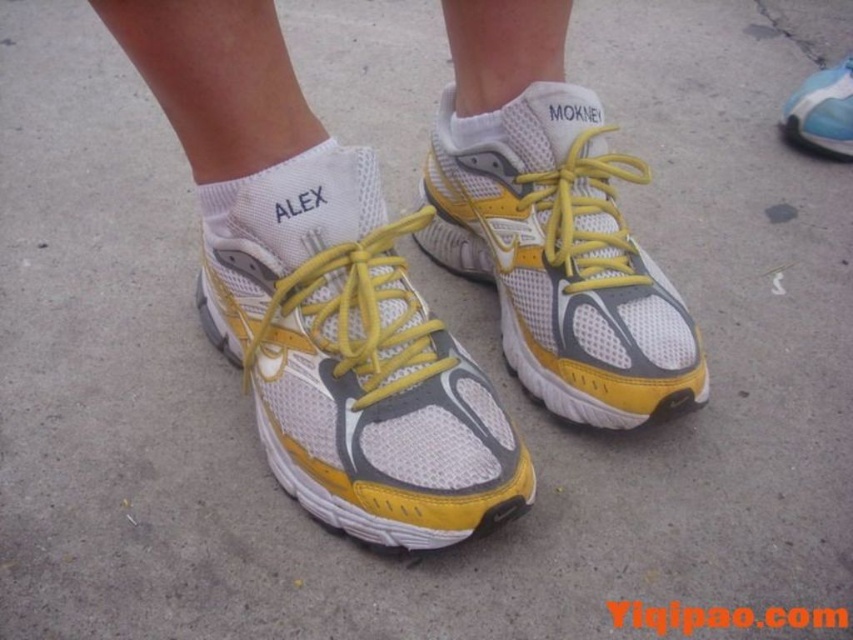
Does yellow mesh running shoe at center appear over white fabric sock at center?

Incorrect, yellow mesh running shoe at center is not positioned above white fabric sock at center.

Who is taller, yellow mesh running shoe at center or white fabric sock at center?

Standing taller between the two is yellow mesh running shoe at center.

Does point (445, 436) come in front of point (265, 198)?

Yes, it is.

This screenshot has height=640, width=853. I want to click on yellow mesh running shoe at center, so click(x=352, y=358).

Does yellow mesh running shoe at center appear over yellow mesh shoe at center?

No, yellow mesh running shoe at center is not above yellow mesh shoe at center.

How much distance is there between yellow mesh running shoe at center and yellow mesh shoe at center?

A distance of 10.19 inches exists between yellow mesh running shoe at center and yellow mesh shoe at center.

Describe the element at coordinates (352, 358) in the screenshot. I see `yellow mesh running shoe at center` at that location.

The height and width of the screenshot is (640, 853). Identify the location of yellow mesh running shoe at center. (352, 358).

Does point (521, 323) come farther from viewer compared to point (833, 144)?

No, (521, 323) is in front of (833, 144).

Does yellow mesh shoe at center appear on the left side of yellow mesh shoe at upper right?

Indeed, yellow mesh shoe at center is positioned on the left side of yellow mesh shoe at upper right.

You are a GUI agent. You are given a task and a screenshot of the screen. Output one action in this format:
    pyautogui.click(x=<x>, y=<y>)
    Task: Click on the yellow mesh shoe at center
    
    Given the screenshot: What is the action you would take?
    pyautogui.click(x=560, y=257)